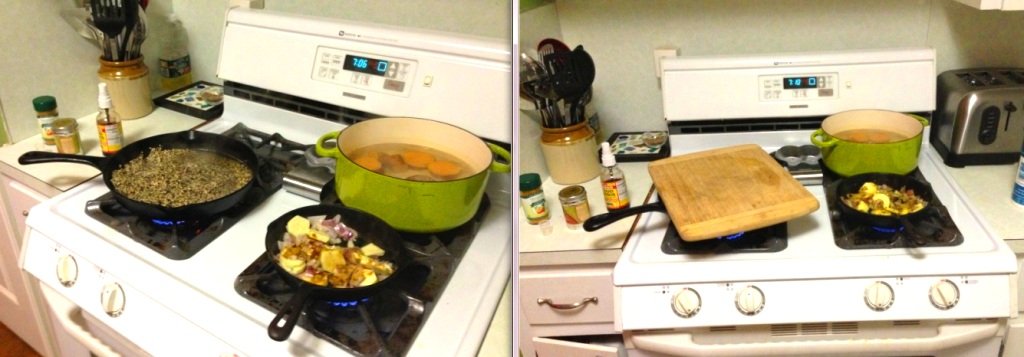
Find the location of a particular element. This screenshot has width=1024, height=357. cutting board is located at coordinates [713, 182].